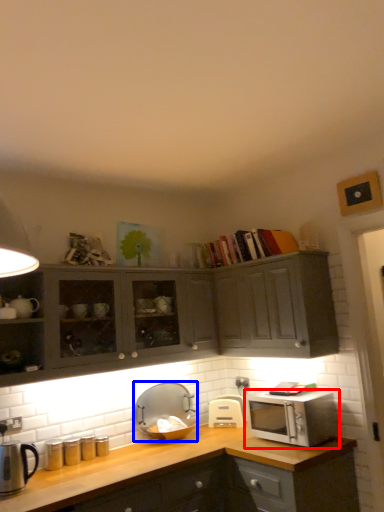
Question: Which of the following is the closest to the observer, microwave oven (highlighted by a red box) or appliance (highlighted by a blue box)?

Choices:
 (A) microwave oven
 (B) appliance

Answer: (A)